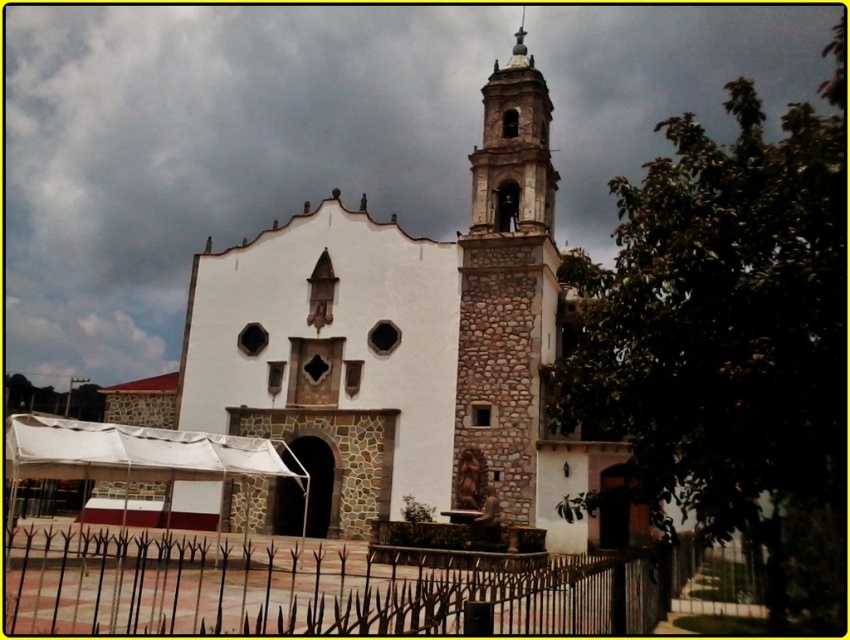
Is black wrought iron fence at lower center positioned at the back of stone textured tower at center?

No, black wrought iron fence at lower center is in front of stone textured tower at center.

Which of these two, black wrought iron fence at lower center or stone textured tower at center, stands shorter?

Standing shorter between the two is black wrought iron fence at lower center.

Does point (323, 595) come farther from viewer compared to point (528, 432)?

No, it is not.

Locate an element on the screen. The height and width of the screenshot is (640, 850). black wrought iron fence at lower center is located at coordinates (326, 586).